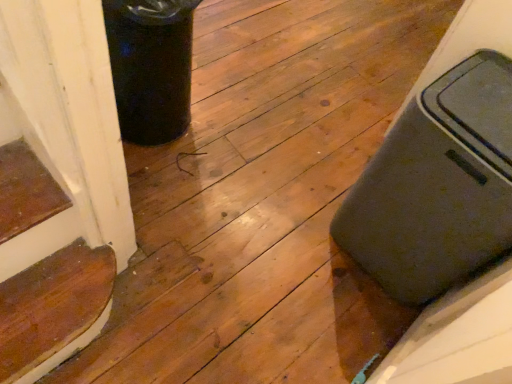
Locate an element on the screen. This screenshot has width=512, height=384. free space above wooden stair at lower left (from a real-world perspective) is located at coordinates (51, 294).